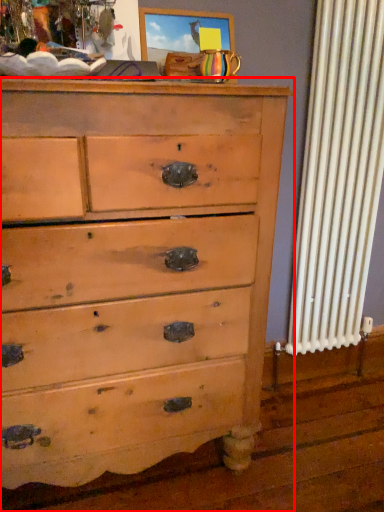
Question: Considering the relative positions of chest of drawers (annotated by the red box) and picture frame in the image provided, where is chest of drawers (annotated by the red box) located with respect to the staircase?

Choices:
 (A) right
 (B) left

Answer: (B)